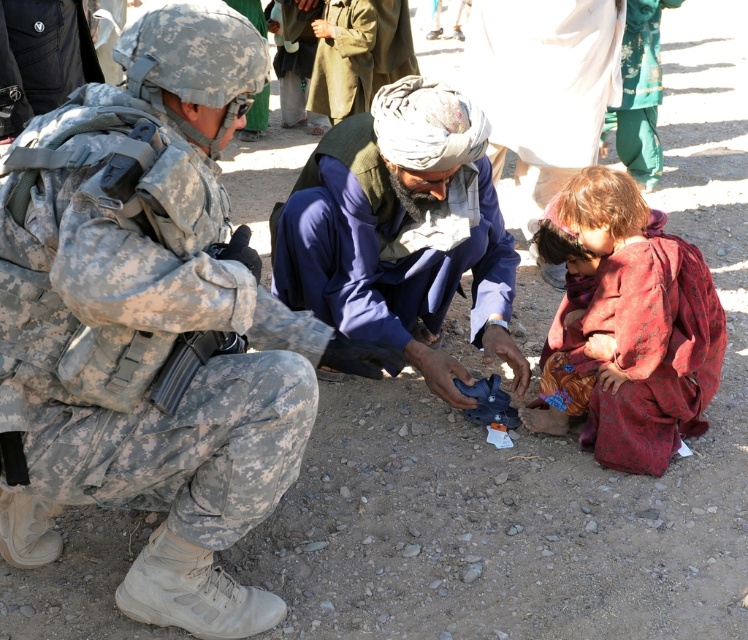
You are a drone operator trying to locate a specific object in an outdoor scene. The scene has a soldier and two civilians. You need to identify the exact position of the blue fabric turban at center. What are its coordinates?

The blue fabric turban at center is located at coordinates point (401, 230).

You are a drone operator trying to deliver a package to either the soldier or the civilians in the scene. The coordinates of the soldier are at point (346, 346) and the civilians are at point (649, 387). If you want to deliver the package to the closer recipient, which point should you aim for?

Point (346, 346) is closer to the viewer than point (649, 387), so you should aim for the soldier at point (346, 346) to deliver the package to the closer recipient.

You are a photographer trying to capture a photo of the camouflage fabric uniform at left and the red fabric dress at lower right. To ensure both are in focus, you need to know their vertical positions. Which object is positioned lower in the image?

The camouflage fabric uniform at left is located below red fabric dress at lower right, so the camouflage fabric uniform at left is positioned lower in the image.